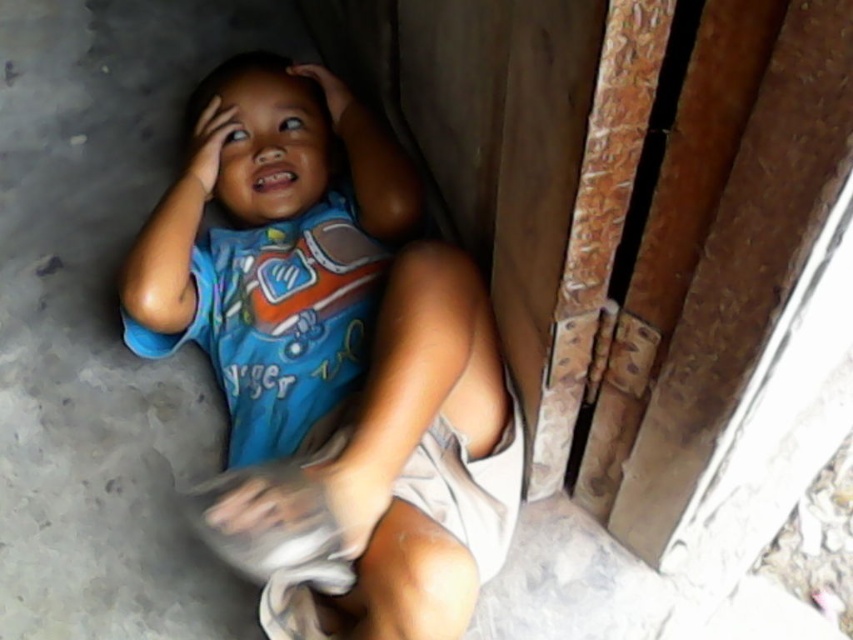
You are a parent trying to dress your child. You see the blue cotton shirt at center and the blue fabric head at upper center. Which item should you put on first according to the spatial arrangement?

The blue cotton shirt at center should be put on first because it is in front of the blue fabric head at upper center, indicating it is already worn and needs to be adjusted or removed before accessing the headpiece.

You are a tailor trying to determine if the blue cotton shirt at center can be altered to fit the blue fabric head at upper center. Based on their widths, can the shirt accommodate the headpiece?

The blue cotton shirt at center is wider than the blue fabric head at upper center, so the shirt can accommodate the headpiece since its width is sufficient.